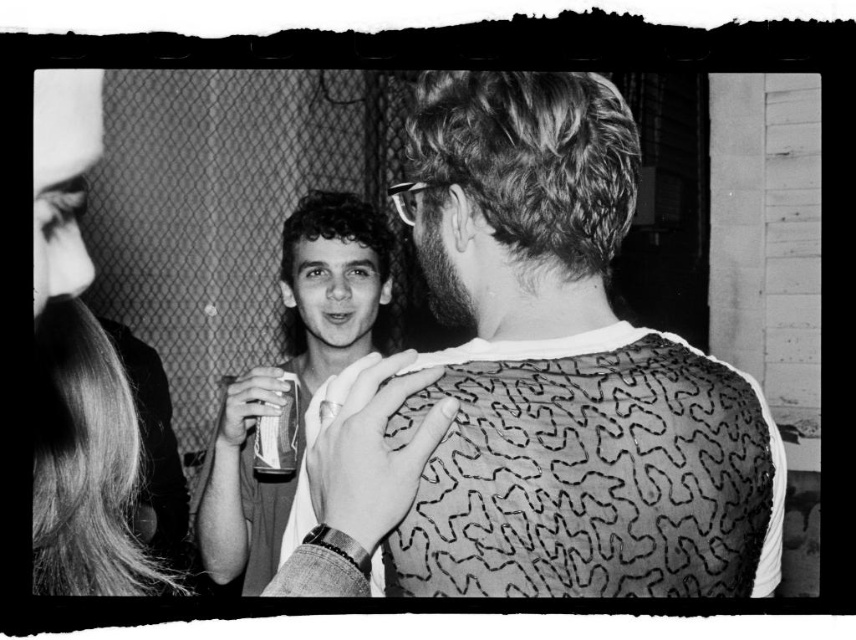
You are standing in the scene and want to take a photo of both point [120,376] and point [259,492]. Which point should you focus on first to ensure both are in clear view?

You should focus on point [120,376] first since it is closer to the camera than point [259,492]. This ensures that both points will be in focus as the depth of field can cover the distance between them.

You are organizing a charity event and need to arrange two shirts on a display rack. The shirts are the patterned fabric shirt at center and the smooth white shirt at center. Based on their sizes, which shirt should you place on the lower shelf to ensure proper visibility of both?

The patterned fabric shirt at center should be placed on the lower shelf because it is shorter than the smooth white shirt at center, allowing the taller smooth white shirt to be displayed above it for better visibility.

You are standing at the point marked as point (79, 560) in the image. You want to reach the door located at the opposite side of the room without moving closer than 30 inches to any person in the scene. Can you safely proceed to the door?

The point marked as point (79, 560) is 33.66 inches away from the viewer. Since the required minimum distance is 30 inches, you can safely proceed to the door as the distance is sufficient.